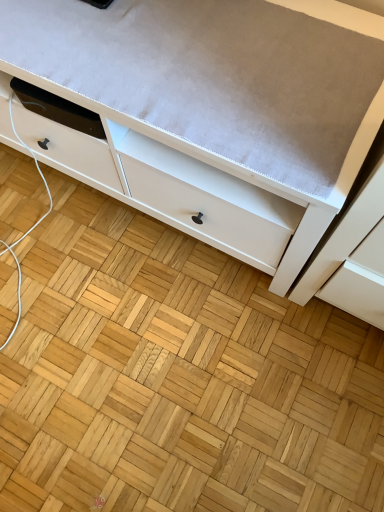
Where is `white matte chest of drawers at center`? white matte chest of drawers at center is located at coordinates (208, 111).

This screenshot has width=384, height=512. What do you see at coordinates (208, 111) in the screenshot?
I see `white matte chest of drawers at center` at bounding box center [208, 111].

In order to click on white matte chest of drawers at center in this screenshot , I will do `click(208, 111)`.